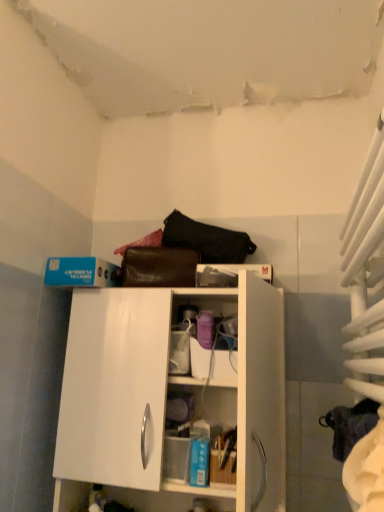
Question: Is white fabric curtain at right aimed at white glossy cabinet at center?

Choices:
 (A) no
 (B) yes

Answer: (B)

Question: Does white fabric curtain at right have a larger size compared to white glossy cabinet at center?

Choices:
 (A) yes
 (B) no

Answer: (B)

Question: Would you say white glossy cabinet at center is part of white fabric curtain at right's contents?

Choices:
 (A) yes
 (B) no

Answer: (B)

Question: Is white fabric curtain at right smaller than white glossy cabinet at center?

Choices:
 (A) no
 (B) yes

Answer: (B)

Question: Can we say white fabric curtain at right lies outside white glossy cabinet at center?

Choices:
 (A) no
 (B) yes

Answer: (B)

Question: Is white fabric curtain at right looking in the opposite direction of white glossy cabinet at center?

Choices:
 (A) no
 (B) yes

Answer: (A)

Question: Can you confirm if white glossy cabinet at center is smaller than black leather handbag at upper center?

Choices:
 (A) no
 (B) yes

Answer: (A)

Question: Is white glossy cabinet at center behind black leather handbag at upper center?

Choices:
 (A) yes
 (B) no

Answer: (B)

Question: Is white glossy cabinet at center to the left of black leather handbag at upper center from the viewer's perspective?

Choices:
 (A) no
 (B) yes

Answer: (B)

Question: Can you confirm if white glossy cabinet at center is wider than black leather handbag at upper center?

Choices:
 (A) yes
 (B) no

Answer: (A)

Question: From the image's perspective, is white glossy cabinet at center above black leather handbag at upper center?

Choices:
 (A) no
 (B) yes

Answer: (A)

Question: Are white glossy cabinet at center and black leather handbag at upper center far apart?

Choices:
 (A) yes
 (B) no

Answer: (B)

Question: Is black leather handbag at upper center not close to white fabric curtain at right?

Choices:
 (A) yes
 (B) no

Answer: (B)